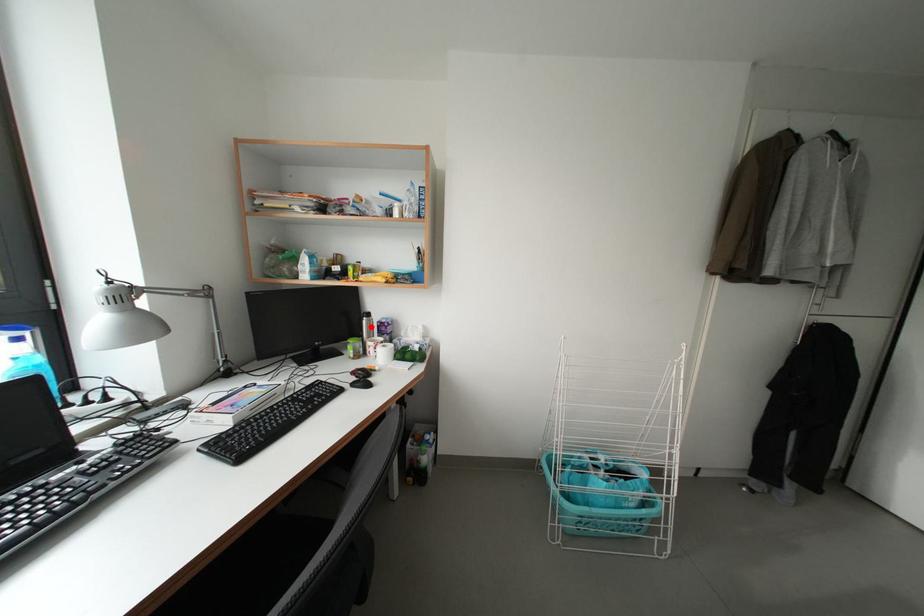
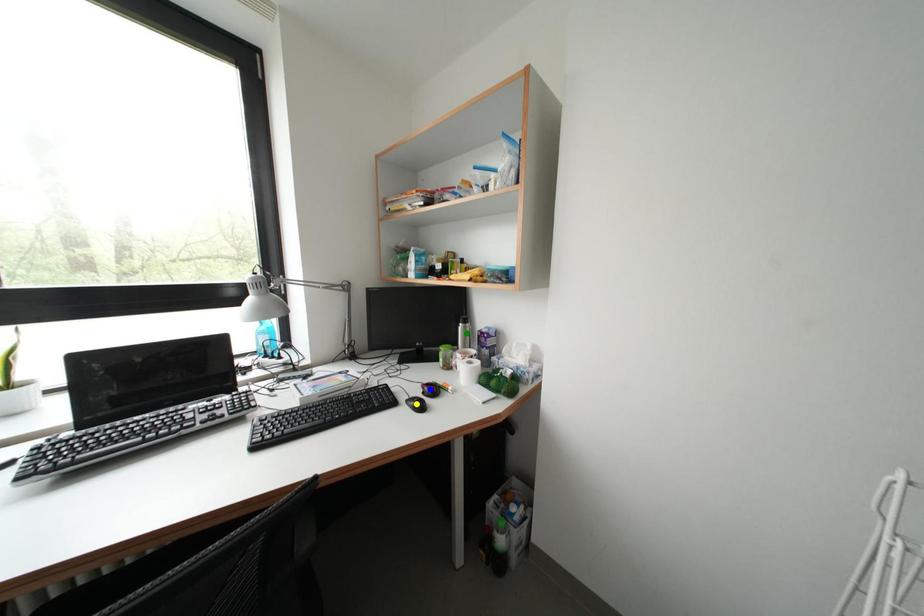
Question: I am providing you with two images of the same scene from different viewpoints. A red point is marked on the first image. You are given multiple points on the second image. Which mark in image 2 goes with the point in image 1?

Choices:
 (A) green point
 (B) blue point
 (C) yellow point

Answer: (A)